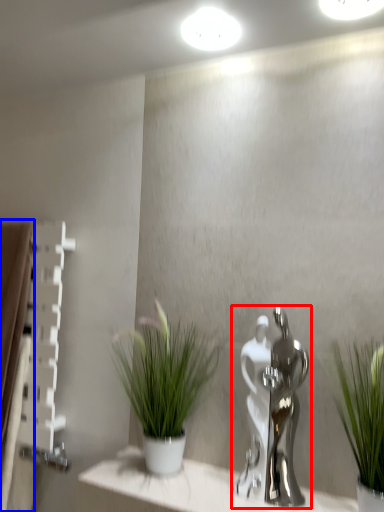
Question: Which object is further to the camera taking this photo, tap (highlighted by a red box) or curtain (highlighted by a blue box)?

Choices:
 (A) tap
 (B) curtain

Answer: (B)